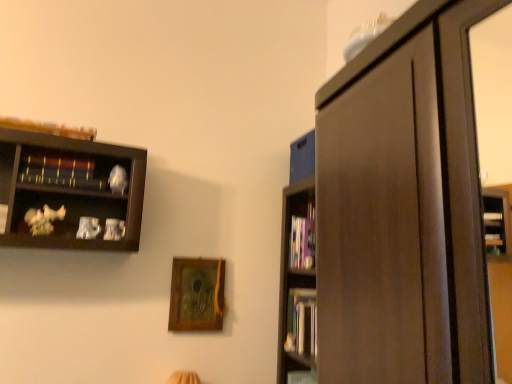
Question: Is wooden picture frame at center bigger than wooden bookshelf at upper left, which appears as the second book when viewed from the front?

Choices:
 (A) yes
 (B) no

Answer: (A)

Question: Does wooden picture frame at center lie in front of wooden bookshelf at upper left, arranged as the second book when viewed from the top?

Choices:
 (A) yes
 (B) no

Answer: (B)

Question: From the image's perspective, would you say wooden picture frame at center is shown under wooden bookshelf at upper left, which appears as the second book when viewed from the front?

Choices:
 (A) no
 (B) yes

Answer: (B)

Question: Considering the relative sizes of wooden picture frame at center and wooden bookshelf at upper left, which appears as the second book when viewed from the front, in the image provided, is wooden picture frame at center taller than wooden bookshelf at upper left, which appears as the second book when viewed from the front,?

Choices:
 (A) yes
 (B) no

Answer: (A)

Question: Is wooden picture frame at center oriented towards wooden bookshelf at upper left, which ranks as the 3th book in right-to-left order?

Choices:
 (A) no
 (B) yes

Answer: (A)

Question: From the image's perspective, is hardcover books at right, the third book in the front-to-back sequence, positioned above or below wooden bookshelf at upper left, which appears as the second book when viewed from the front?

Choices:
 (A) above
 (B) below

Answer: (B)

Question: From a real-world perspective, is hardcover books at right, marked as the second book in a right-to-left arrangement, positioned above or below wooden bookshelf at upper left, which appears as the second book when viewed from the front?

Choices:
 (A) above
 (B) below

Answer: (B)

Question: Is hardcover books at right, the third book in the front-to-back sequence, in front of or behind wooden bookshelf at upper left, which appears as the second book when viewed from the front, in the image?

Choices:
 (A) front
 (B) behind

Answer: (B)

Question: Considering the positions of hardcover books at right, marked as the 1th book in a bottom-to-top arrangement, and wooden bookshelf at upper left, which appears as the second book when viewed from the front, in the image, is hardcover books at right, marked as the 1th book in a bottom-to-top arrangement, wider or thinner than wooden bookshelf at upper left, which appears as the second book when viewed from the front,?

Choices:
 (A) wide
 (B) thin

Answer: (A)

Question: From the image's perspective, relative to hardcover book at center, arranged as the third book when viewed from the top, is hardcover books at right, placed as the 4th book when sorted from top to bottom, above or below?

Choices:
 (A) below
 (B) above

Answer: (A)

Question: From a real-world perspective, relative to hardcover book at center, acting as the fourth book starting from the front, is hardcover books at right, which appears as the third book when viewed from the left, vertically above or below?

Choices:
 (A) below
 (B) above

Answer: (A)

Question: In terms of width, does hardcover books at right, marked as the second book in a right-to-left arrangement, look wider or thinner when compared to hardcover book at center, which is counted as the first book, starting from the right?

Choices:
 (A) wide
 (B) thin

Answer: (B)

Question: Is point (313, 324) positioned closer to the camera than point (309, 221)?

Choices:
 (A) closer
 (B) farther

Answer: (A)

Question: Would you say wooden book at upper left, acting as the 4th book starting from the back, is inside or outside wooden bookshelf at upper left, which ranks as the 3th book in right-to-left order?

Choices:
 (A) outside
 (B) inside

Answer: (A)

Question: Is wooden book at upper left, acting as the 4th book starting from the back, bigger or smaller than wooden bookshelf at upper left, which is the 3th book from back to front?

Choices:
 (A) big
 (B) small

Answer: (B)